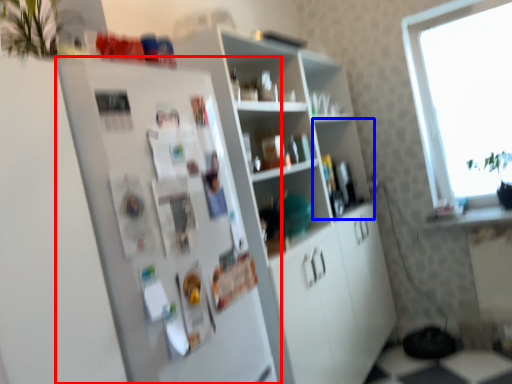
Question: Which object appears closest to the camera in this image, fridge (highlighted by a red box) or shelf (highlighted by a blue box)?

Choices:
 (A) fridge
 (B) shelf

Answer: (A)